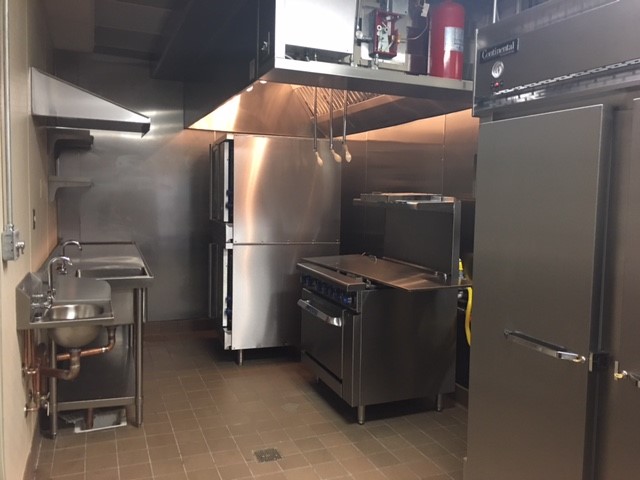
Where is `yellow cable`? The image size is (640, 480). yellow cable is located at coordinates (470, 302), (460, 267).